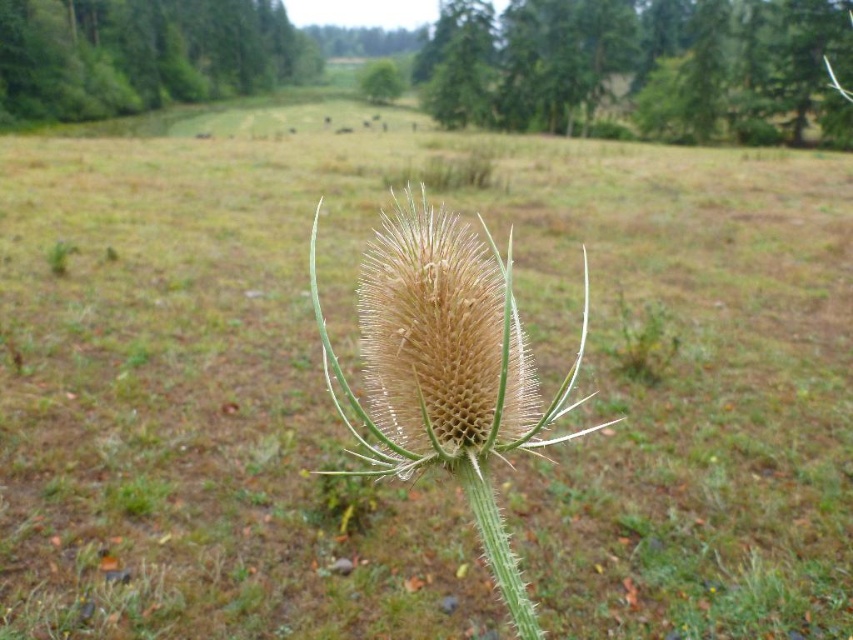
Question: In this image, where is brown fuzzy thistle at center located relative to green spiny stem at center?

Choices:
 (A) above
 (B) below

Answer: (A)

Question: Can you confirm if green textured tree at upper center is positioned below green fuzzy tree at upper left?

Choices:
 (A) yes
 (B) no

Answer: (A)

Question: Is green textured tree at upper center bigger than brown fuzzy thistle at center?

Choices:
 (A) yes
 (B) no

Answer: (A)

Question: Which object is farther from the camera taking this photo?

Choices:
 (A) green textured tree at upper center
 (B) green fuzzy tree at upper left
 (C) brown fuzzy thistle at center

Answer: (B)

Question: Estimate the real-world distances between objects in this image. Which object is farther from the green textured tree at upper center?

Choices:
 (A) brown fuzzy thistle at center
 (B) green spiny stem at center

Answer: (B)

Question: Which point is closer to the camera?

Choices:
 (A) (447, 452)
 (B) (473, 492)

Answer: (A)